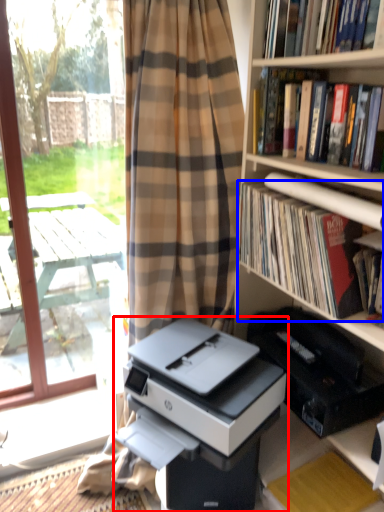
Question: Among these objects, which one is nearest to the camera, printer (highlighted by a red box) or book (highlighted by a blue box)?

Choices:
 (A) printer
 (B) book

Answer: (A)